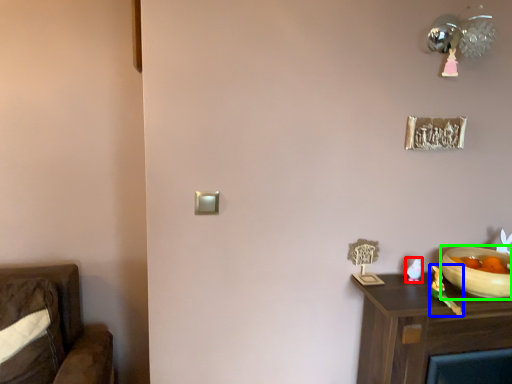
Question: Estimate the real-world distances between objects in this image. Which object is farther from toy (highlighted by a red box), toy (highlighted by a blue box) or bowl (highlighted by a green box)?

Choices:
 (A) toy
 (B) bowl

Answer: (B)